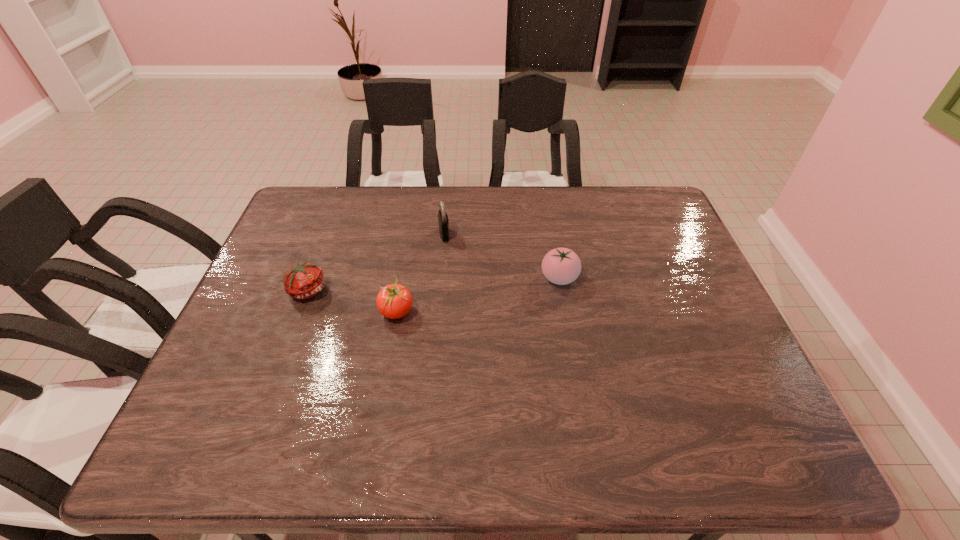
Identify the location of vacant area that lies between the rightmost tomato and the leftmost object. (434, 284).

At what (x,y) coordinates should I click in order to perform the action: click on vacant area that lies between the leftmost object and the rightmost object. Please return your answer as a coordinate pair (x, y). Image resolution: width=960 pixels, height=540 pixels. Looking at the image, I should click on point(434,284).

Locate an element on the screen. The width and height of the screenshot is (960, 540). free space between the second tomato from right to left and the rightmost tomato is located at coordinates (478, 295).

In order to click on empty space between the padlock and the second object from left to right in this screenshot , I will do `click(420, 273)`.

Image resolution: width=960 pixels, height=540 pixels. What are the coordinates of `vacant space that is in between the padlock and the rightmost tomato` in the screenshot? It's located at coord(502,256).

What are the coordinates of `blank region between the rightmost object and the farthest object` in the screenshot? It's located at (502, 256).

Select which object appears as the third closest to the leftmost tomato. Please provide its 2D coordinates. Your answer should be formatted as a tuple, i.e. [(x, y)], where the tuple contains the x and y coordinates of a point satisfying the conditions above.

[(561, 266)]

Select which object appears as the second closest to the second object from left to right. Please provide its 2D coordinates. Your answer should be formatted as a tuple, i.e. [(x, y)], where the tuple contains the x and y coordinates of a point satisfying the conditions above.

[(443, 221)]

Locate which tomato is the closest to the rightmost tomato. Please provide its 2D coordinates. Your answer should be formatted as a tuple, i.e. [(x, y)], where the tuple contains the x and y coordinates of a point satisfying the conditions above.

[(394, 301)]

Identify the location of tomato identified as the closest to the leftmost tomato. (394, 301).